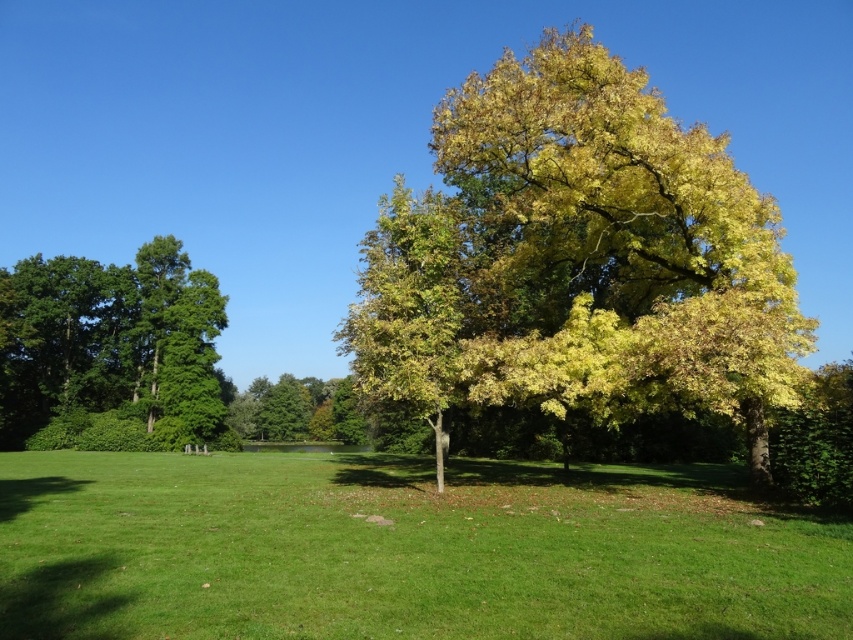
Question: Which point is farther to the camera?

Choices:
 (A) green leafy tree at center
 (B) yellow-green foliage at center

Answer: (A)

Question: Does yellow-green foliage at center appear over green leafy tree at left?

Choices:
 (A) yes
 (B) no

Answer: (A)

Question: Which object is closer to the camera taking this photo?

Choices:
 (A) yellow-green foliage at center
 (B) green leafy tree at left
 (C) green leafy tree at center
 (D) green grassy at center

Answer: (D)

Question: Estimate the real-world distances between objects in this image. Which object is farther from the green grassy at center?

Choices:
 (A) yellow-green foliage at center
 (B) green leafy tree at center

Answer: (B)

Question: Is green leafy tree at left behind green leafy tree at center?

Choices:
 (A) yes
 (B) no

Answer: (B)

Question: From the image, what is the correct spatial relationship of yellow-green foliage at center in relation to green leafy tree at left?

Choices:
 (A) right
 (B) left

Answer: (A)